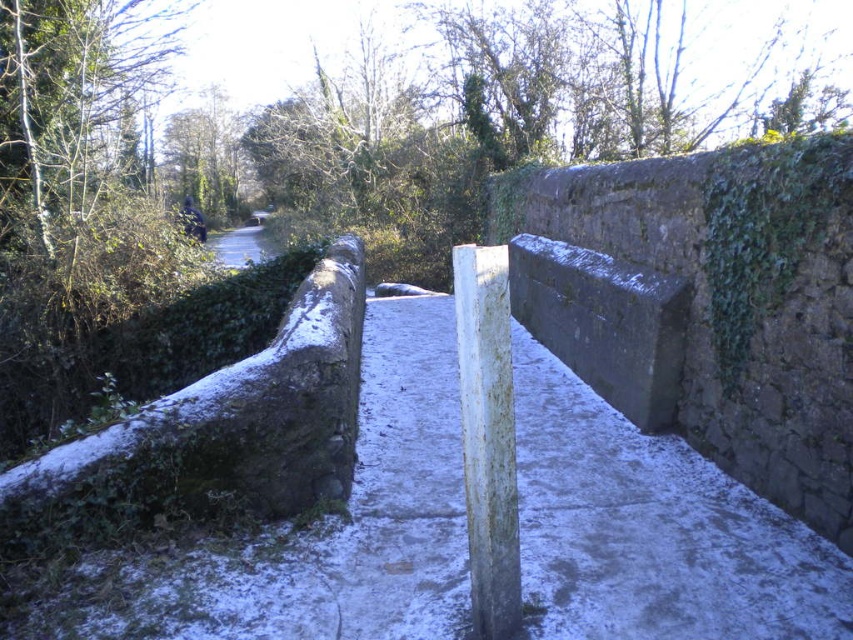
You are a delivery person trying to navigate the narrow stone bridge. You notice the gray stone barrier at center and the white weathered wood post at center. Which object is positioned higher relative to the other?

The gray stone barrier at center is located above the white weathered wood post at center, so it is positioned higher.

You are standing on the narrow stone bridge and want to reach the gray stone barrier at center. According to the image, where exactly should you walk towards?

The gray stone barrier at center is located at the coordinates point (604,323), so you should walk towards that point to reach it.

You are a delivery person carrying a large box and need to cross the narrow stone bridge. The box is 6 meters long. There is a gray stone barrier at center dividing the path. Can you safely carry the box across the bridge without it hitting the barrier?

The gray stone barrier at center is 5.89 meters away from the edge, so the 6 meter box will not fit between the edges of the bridge. You need to find another path.